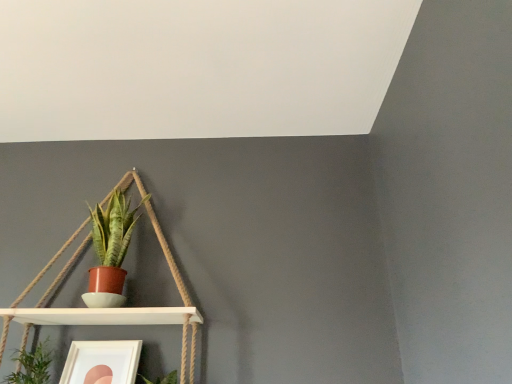
Question: From a real-world perspective, does matte terracotta pot at center-left, positioned as the 2th houseplant in left-to-right order, sit lower than green leafy plant at lower left, which is the second houseplant from top to bottom?

Choices:
 (A) no
 (B) yes

Answer: (A)

Question: Is matte terracotta pot at center-left, positioned as the 2th houseplant in left-to-right order, not close to green leafy plant at lower left, the 1th houseplant from the bottom?

Choices:
 (A) no
 (B) yes

Answer: (A)

Question: Could you tell me if matte terracotta pot at center-left, marked as the 1th houseplant in a right-to-left arrangement, is facing green leafy plant at lower left, the first houseplant in the left-to-right sequence?

Choices:
 (A) yes
 (B) no

Answer: (B)

Question: From the image's perspective, would you say matte terracotta pot at center-left, positioned as the 2th houseplant in left-to-right order, is shown under green leafy plant at lower left, which is the 2th houseplant in right-to-left order?

Choices:
 (A) no
 (B) yes

Answer: (A)

Question: Can you confirm if matte terracotta pot at center-left, the second houseplant in the bottom-to-top sequence, is smaller than green leafy plant at lower left, which is the 2th houseplant in right-to-left order?

Choices:
 (A) no
 (B) yes

Answer: (A)

Question: Can you confirm if matte terracotta pot at center-left, the second houseplant in the bottom-to-top sequence, is bigger than green leafy plant at lower left, the 1th houseplant from the bottom?

Choices:
 (A) yes
 (B) no

Answer: (A)

Question: Is green leafy plant at lower left, the 1th houseplant from the bottom, bigger than white matte shelf at left?

Choices:
 (A) yes
 (B) no

Answer: (B)

Question: Could you tell me if green leafy plant at lower left, which is the second houseplant from top to bottom, is facing white matte shelf at left?

Choices:
 (A) yes
 (B) no

Answer: (A)

Question: Can we say green leafy plant at lower left, the first houseplant in the left-to-right sequence, lies outside white matte shelf at left?

Choices:
 (A) no
 (B) yes

Answer: (A)

Question: Are green leafy plant at lower left, the first houseplant in the left-to-right sequence, and white matte shelf at left beside each other?

Choices:
 (A) no
 (B) yes

Answer: (A)

Question: From the image's perspective, is green leafy plant at lower left, which is the 2th houseplant in right-to-left order, located beneath white matte shelf at left?

Choices:
 (A) no
 (B) yes

Answer: (B)

Question: Considering the relative sizes of green leafy plant at lower left, which is the 2th houseplant in right-to-left order, and white matte shelf at left in the image provided, is green leafy plant at lower left, which is the 2th houseplant in right-to-left order, smaller than white matte shelf at left?

Choices:
 (A) yes
 (B) no

Answer: (A)

Question: Considering the relative positions of white matte picture frame at lower left and green leafy plant at lower left, the 1th houseplant from the bottom, in the image provided, is white matte picture frame at lower left behind green leafy plant at lower left, the 1th houseplant from the bottom,?

Choices:
 (A) no
 (B) yes

Answer: (B)